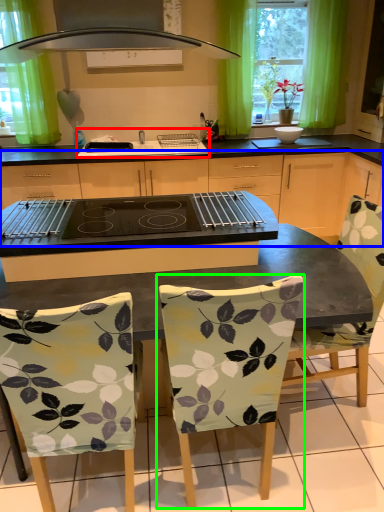
Question: Considering the real-world distances, which object is farthest from sink (highlighted by a red box)? cabinetry (highlighted by a blue box) or chair (highlighted by a green box)?

Choices:
 (A) cabinetry
 (B) chair

Answer: (B)